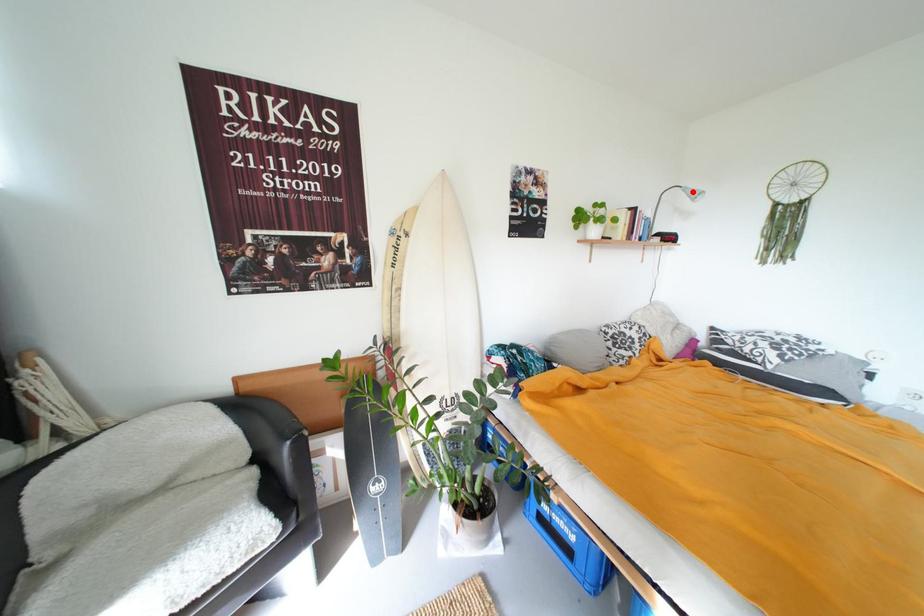
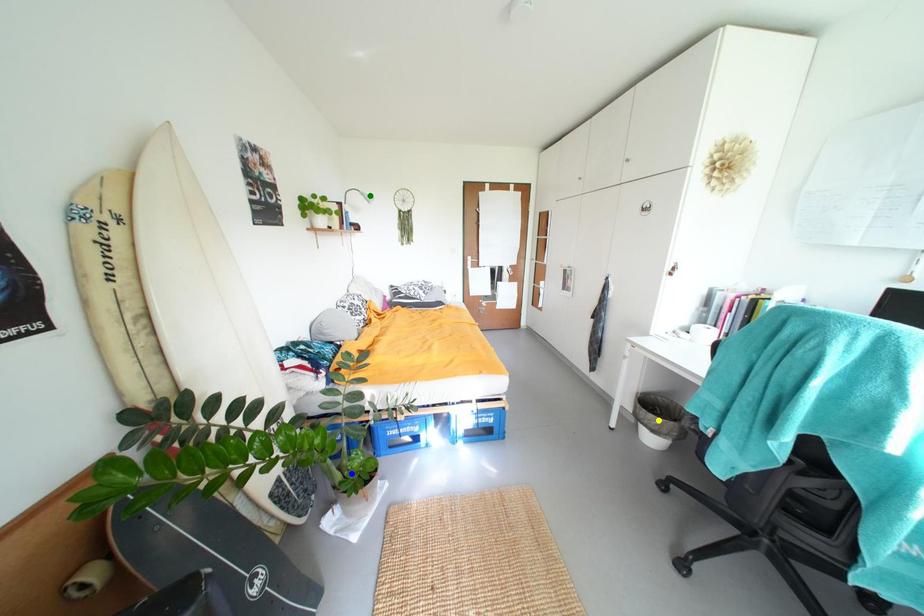
Question: I am providing you with two images of the same scene from different viewpoints. A red point is marked on the first image. You are given multiple points on the second image. Can you choose the point in image 2 that corresponds to the point in image 1?

Choices:
 (A) yellow point
 (B) blue point
 (C) green point

Answer: (C)